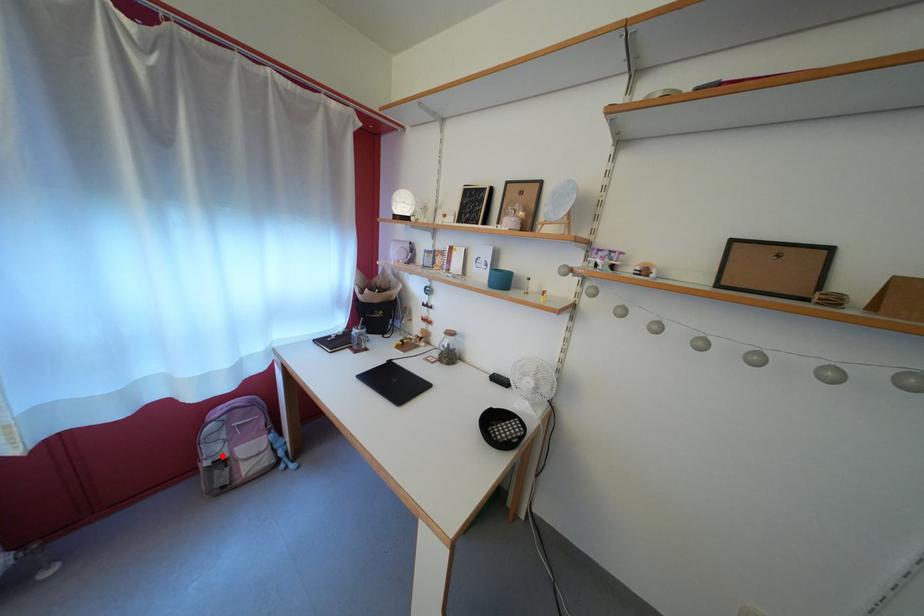
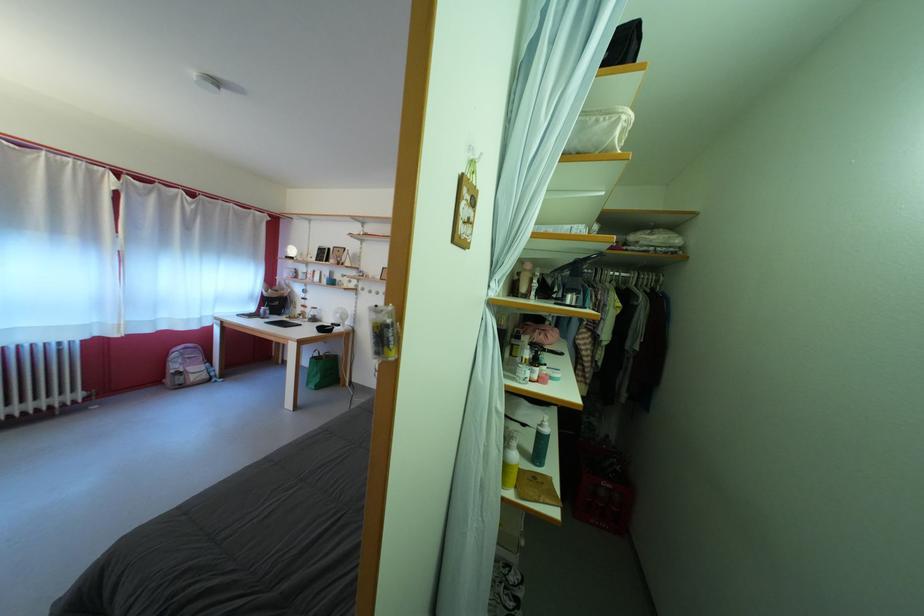
The point at the highlighted location is marked in the first image. Where is the corresponding point in the second image?

(184, 373)